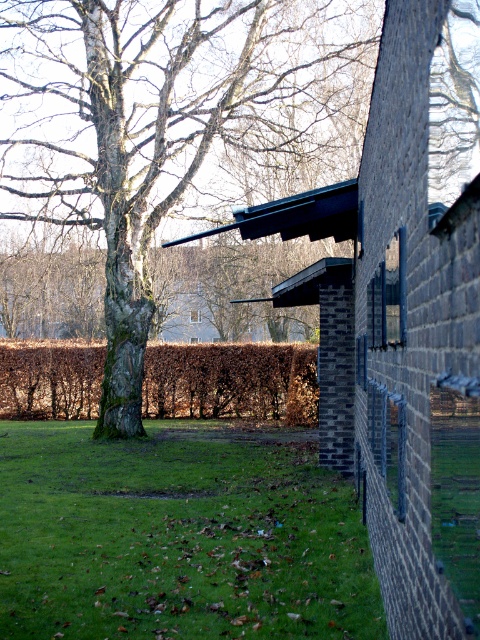
Does green grass at lower center have a greater width compared to brown leafy hedge at center?

Incorrect, green grass at lower center's width does not surpass brown leafy hedge at center's.

Is green grass at lower center positioned behind brown leafy hedge at center?

No, green grass at lower center is closer to the viewer.

Does point (111, 621) lie in front of point (302, 417)?

That is True.

Where is `green grass at lower center`? The width and height of the screenshot is (480, 640). green grass at lower center is located at coordinates (180, 536).

How far apart are smooth bark tree at center and green grass at lower center?

The distance of smooth bark tree at center from green grass at lower center is 24.46 feet.

Is smooth bark tree at center to the right of green grass at lower center from the viewer's perspective?

In fact, smooth bark tree at center is to the left of green grass at lower center.

Where is `smooth bark tree at center`? This screenshot has width=480, height=640. smooth bark tree at center is located at coordinates (158, 124).

In order to click on smooth bark tree at center in this screenshot , I will do `click(158, 124)`.

Which is more to the left, smooth bark tree at center or brown leafy hedge at center?

From the viewer's perspective, brown leafy hedge at center appears more on the left side.

Between point (284, 4) and point (37, 380), which one is positioned in front?

Point (284, 4)

Locate an element on the screen. This screenshot has width=480, height=640. smooth bark tree at center is located at coordinates pyautogui.click(x=158, y=124).

Where is `smooth bark tree at center`? This screenshot has width=480, height=640. smooth bark tree at center is located at coordinates (158, 124).